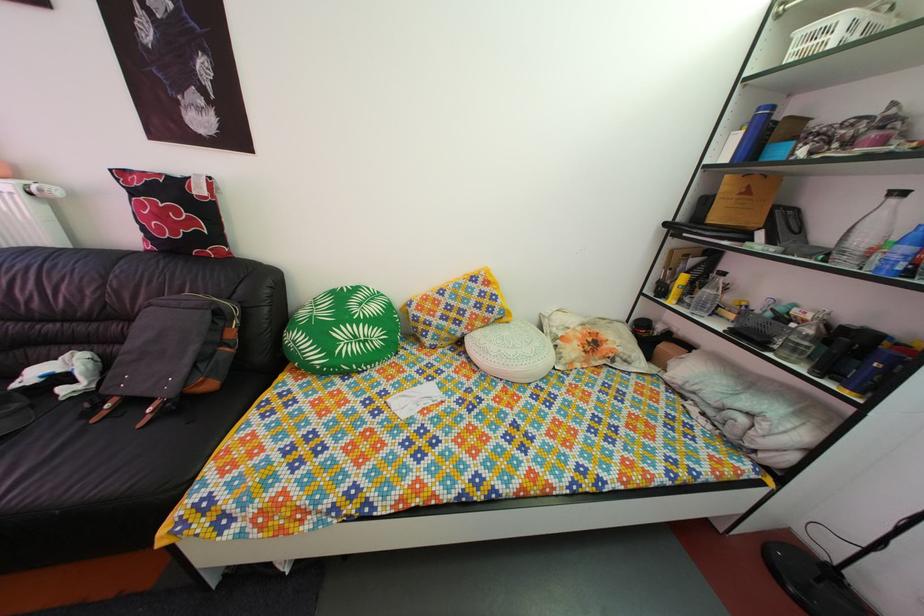
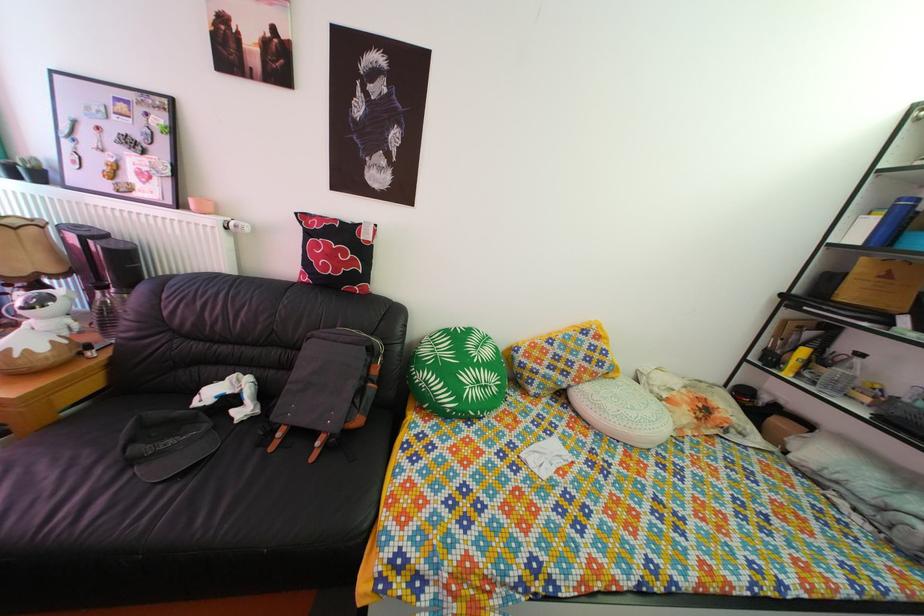
Question: The images are taken continuously from a first-person perspective. In which direction is your viewpoint rotating?

Choices:
 (A) Left
 (B) Right
 (C) Up
 (D) Down

Answer: (C)